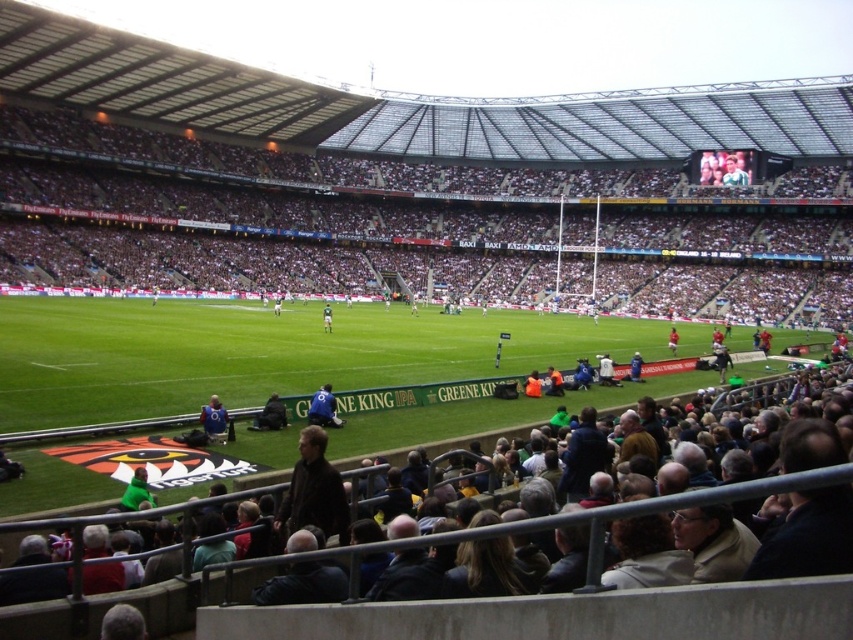
Question: Where is dark brown leather seats at lower center located in relation to blue fabric jacket at lower center in the image?

Choices:
 (A) below
 (B) above

Answer: (B)

Question: Which object appears closest to the camera in this image?

Choices:
 (A) dark blue jacket at lower center
 (B) light brown leather jacket at center

Answer: (A)

Question: Is the position of blue jersey at center less distant than that of blue fabric jacket at lower center?

Choices:
 (A) no
 (B) yes

Answer: (A)

Question: Which of the following is the closest to the observer?

Choices:
 (A) (733, 483)
 (B) (321, 422)

Answer: (A)

Question: Which object is farther from the camera taking this photo?

Choices:
 (A) blue fabric jacket at lower center
 (B) light brown leather jacket at center
 (C) dark brown leather seats at lower center
 (D) dark blue jacket at lower center

Answer: (B)

Question: Does dark brown leather seats at lower center have a lesser width compared to blue fabric jacket at lower center?

Choices:
 (A) no
 (B) yes

Answer: (A)